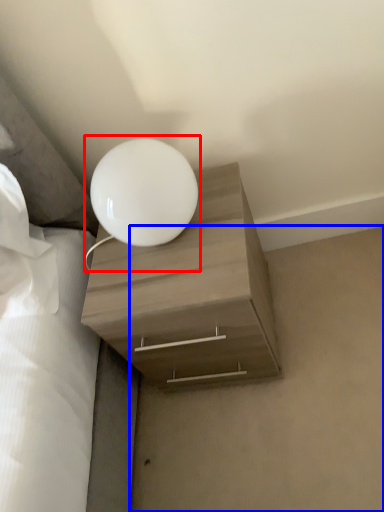
Question: Among these objects, which one is nearest to the camera, lamp (highlighted by a red box) or concrete (highlighted by a blue box)?

Choices:
 (A) lamp
 (B) concrete

Answer: (A)